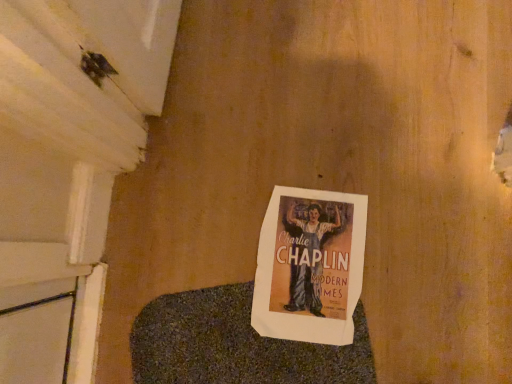
The image size is (512, 384). I want to click on free spot to the right of matte paper poster at center, so click(421, 248).